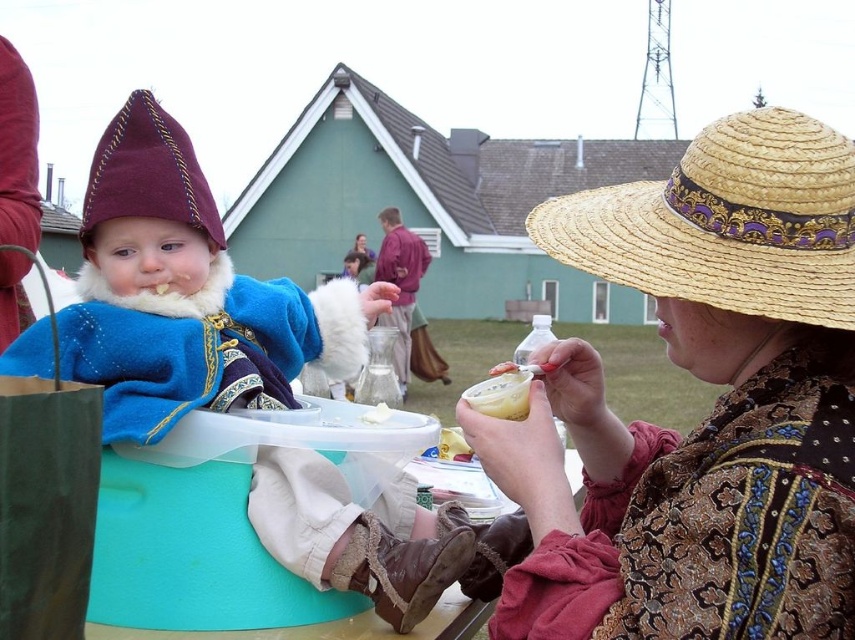
Question: Which is farther from the straw hat at upper right?

Choices:
 (A) natural straw hat at center
 (B) velvet blue robe at center

Answer: (A)

Question: Can you confirm if rustic straw hat at upper right is wider than velvet blue robe at center?

Choices:
 (A) yes
 (B) no

Answer: (B)

Question: Does rustic straw hat at upper right appear under natural straw hat at center?

Choices:
 (A) yes
 (B) no

Answer: (A)

Question: Does rustic straw hat at upper right have a smaller size compared to straw hat at upper right?

Choices:
 (A) yes
 (B) no

Answer: (B)

Question: Among these objects, which one is farthest from the camera?

Choices:
 (A) straw hat at upper right
 (B) natural straw hat at center
 (C) velvet blue robe at center
 (D) rustic straw hat at upper right

Answer: (B)

Question: Which object is farther from the camera taking this photo?

Choices:
 (A) velvet blue robe at center
 (B) straw hat at upper right
 (C) rustic straw hat at upper right
 (D) natural straw hat at center

Answer: (D)